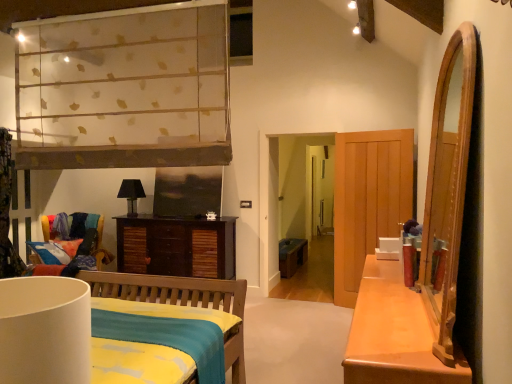
Question: Is multicolored fabric chair at left oriented towards matte black lampshade at center, the first lamp in the left-to-right sequence?

Choices:
 (A) yes
 (B) no

Answer: (B)

Question: Considering the relative sizes of multicolored fabric chair at left and matte black lampshade at center, which ranks as the 2th lamp in front-to-back order, in the image provided, is multicolored fabric chair at left thinner than matte black lampshade at center, which ranks as the 2th lamp in front-to-back order,?

Choices:
 (A) no
 (B) yes

Answer: (A)

Question: Considering the relative positions of multicolored fabric chair at left and matte black lampshade at center, which ranks as the 2th lamp in front-to-back order, in the image provided, is multicolored fabric chair at left to the left of matte black lampshade at center, which ranks as the 2th lamp in front-to-back order, from the viewer's perspective?

Choices:
 (A) no
 (B) yes

Answer: (B)

Question: Does multicolored fabric chair at left have a greater height compared to matte black lampshade at center, the first lamp in the left-to-right sequence?

Choices:
 (A) no
 (B) yes

Answer: (B)

Question: From a real-world perspective, is multicolored fabric chair at left positioned over matte black lampshade at center, the first lamp viewed from the back, based on gravity?

Choices:
 (A) yes
 (B) no

Answer: (B)

Question: Do you think multicolored fabric chair at left is within white matte lampshade at lower left, the 1th lamp in the right-to-left sequence, or outside of it?

Choices:
 (A) inside
 (B) outside

Answer: (B)

Question: From the image's perspective, is multicolored fabric chair at left located above or below white matte lampshade at lower left, the 1th lamp in the right-to-left sequence?

Choices:
 (A) below
 (B) above

Answer: (A)

Question: Is multicolored fabric chair at left to the left or to the right of white matte lampshade at lower left, the 2th lamp in the left-to-right sequence, in the image?

Choices:
 (A) right
 (B) left

Answer: (B)

Question: In terms of width, does multicolored fabric chair at left look wider or thinner when compared to white matte lampshade at lower left, the 2th lamp in the left-to-right sequence?

Choices:
 (A) wide
 (B) thin

Answer: (A)

Question: In terms of height, does dark brown wood cabinet at center look taller or shorter compared to matte black lampshade at center, the first lamp in the left-to-right sequence?

Choices:
 (A) tall
 (B) short

Answer: (A)

Question: Looking at their shapes, would you say dark brown wood cabinet at center is wider or thinner than matte black lampshade at center, which ranks as the 2th lamp in front-to-back order?

Choices:
 (A) wide
 (B) thin

Answer: (A)

Question: In the image, is dark brown wood cabinet at center on the left side or the right side of matte black lampshade at center, the first lamp in the left-to-right sequence?

Choices:
 (A) left
 (B) right

Answer: (B)

Question: Would you say dark brown wood cabinet at center is inside or outside matte black lampshade at center, the 2th lamp when ordered from right to left?

Choices:
 (A) outside
 (B) inside

Answer: (A)

Question: From a real-world perspective, is teal fabric bench at center above or below dark brown wood cabinet at center?

Choices:
 (A) above
 (B) below

Answer: (B)

Question: From the image's perspective, is teal fabric bench at center positioned above or below dark brown wood cabinet at center?

Choices:
 (A) below
 (B) above

Answer: (A)